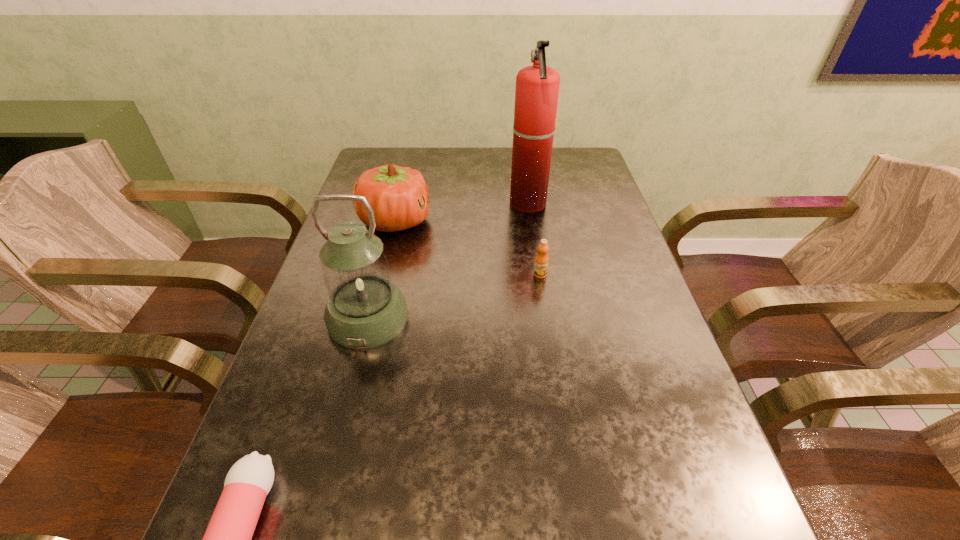
Find the location of a particular element. The width and height of the screenshot is (960, 540). fire extinguisher is located at coordinates (537, 87).

Find the location of `lantern`. lantern is located at coordinates (364, 309).

This screenshot has height=540, width=960. I want to click on the fourth farthest object, so click(364, 309).

I want to click on pumpkin, so click(x=399, y=197).

This screenshot has height=540, width=960. I want to click on the fourth tallest object, so click(x=542, y=260).

This screenshot has width=960, height=540. I want to click on orange juice, so click(542, 260).

Where is `free region located with the nozzle and gauge on the tallest object`? free region located with the nozzle and gauge on the tallest object is located at coordinates (483, 204).

At what (x,y) coordinates should I click in order to perform the action: click on vacant space situated 0.180m with the nozzle and gauge on the tallest object. Please return your answer as a coordinate pair (x, y). This screenshot has height=540, width=960. Looking at the image, I should click on (449, 204).

The width and height of the screenshot is (960, 540). What are the coordinates of `free space located with the nozzle and gauge on the tallest object` in the screenshot? It's located at (479, 204).

You are a GUI agent. You are given a task and a screenshot of the screen. Output one action in this format:
    pyautogui.click(x=<x>, y=<y>)
    Task: Click on the free location located on the right of the second tallest object
    Image resolution: width=960 pixels, height=540 pixels.
    Given the screenshot: What is the action you would take?
    pyautogui.click(x=513, y=318)